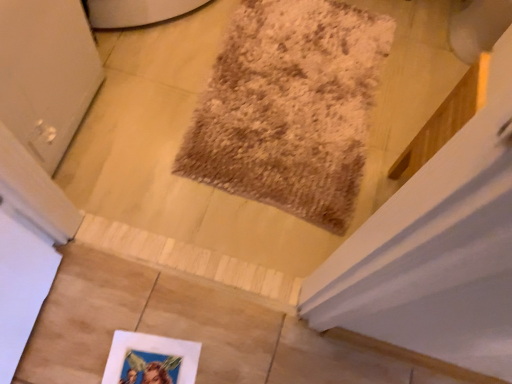
Describe the element at coordinates (150, 359) in the screenshot. I see `white matte picture frame at lower center` at that location.

Locate an element on the screen. This screenshot has width=512, height=384. white matte picture frame at lower center is located at coordinates (150, 359).

At what (x,y) coordinates should I click in order to perform the action: click on brown shaggy mat at center. Please return your answer as a coordinate pair (x, y). Looking at the image, I should click on (290, 107).

What do you see at coordinates (290, 107) in the screenshot?
I see `brown shaggy mat at center` at bounding box center [290, 107].

This screenshot has width=512, height=384. I want to click on white matte picture frame at lower center, so click(150, 359).

Which is more to the right, brown shaggy mat at center or white matte picture frame at lower center?

Positioned to the right is brown shaggy mat at center.

Which object is closer to the camera taking this photo, brown shaggy mat at center or white matte picture frame at lower center?

white matte picture frame at lower center is more forward.

Which is more distant, (355, 103) or (182, 358)?

The point (355, 103) is behind.

From the image's perspective, is brown shaggy mat at center under white matte picture frame at lower center?

Incorrect, from the image's perspective, brown shaggy mat at center is higher than white matte picture frame at lower center.

From a real-world perspective, is brown shaggy mat at center above or below white matte picture frame at lower center?

From a real-world perspective, brown shaggy mat at center is physically above white matte picture frame at lower center.

Is brown shaggy mat at center thinner than white matte picture frame at lower center?

No.

Is brown shaggy mat at center shorter than white matte picture frame at lower center?

In fact, brown shaggy mat at center may be taller than white matte picture frame at lower center.

Is brown shaggy mat at center bigger or smaller than white matte picture frame at lower center?

In the image, brown shaggy mat at center appears to be larger than white matte picture frame at lower center.

Is brown shaggy mat at center completely or partially outside of white matte picture frame at lower center?

brown shaggy mat at center lies outside white matte picture frame at lower center's area.

Is there a large distance between brown shaggy mat at center and white matte picture frame at lower center?

No, brown shaggy mat at center is in close proximity to white matte picture frame at lower center.

Is brown shaggy mat at center turned away from white matte picture frame at lower center?

That's not correct — brown shaggy mat at center is not looking away from white matte picture frame at lower center.

How much distance is there between brown shaggy mat at center and white matte picture frame at lower center?

They are 27.41 inches apart.

Find the location of a particular element. The image size is (512, 384). picture frame below the brown shaggy mat at center (from the image's perspective) is located at coordinates (150, 359).

Is white matte picture frame at lower center at the left side of brown shaggy mat at center?

Yes.

Is white matte picture frame at lower center closer to the viewer compared to brown shaggy mat at center?

Yes, white matte picture frame at lower center is closer to the viewer.

Which is behind, point (139, 336) or point (284, 193)?

The point (284, 193) is behind.

From the image's perspective, between white matte picture frame at lower center and brown shaggy mat at center, which one is located above?

brown shaggy mat at center, from the image's perspective.

From a real-world perspective, which object rests below the other?

From a 3D spatial view, white matte picture frame at lower center is below.

Does white matte picture frame at lower center have a lesser width compared to brown shaggy mat at center?

Correct, the width of white matte picture frame at lower center is less than that of brown shaggy mat at center.

Who is taller, white matte picture frame at lower center or brown shaggy mat at center?

brown shaggy mat at center is taller.

Which of these two, white matte picture frame at lower center or brown shaggy mat at center, is smaller?

white matte picture frame at lower center is smaller.

Is brown shaggy mat at center located within white matte picture frame at lower center?

Actually, brown shaggy mat at center is outside white matte picture frame at lower center.

Does white matte picture frame at lower center touch brown shaggy mat at center?

white matte picture frame at lower center and brown shaggy mat at center are clearly separated.

Could you tell me if white matte picture frame at lower center is turned towards brown shaggy mat at center?

Yes, white matte picture frame at lower center is turned towards brown shaggy mat at center.

At what (x,y) coordinates should I click in order to perform the action: click on picture frame directly beneath the brown shaggy mat at center (from a real-world perspective). Please return your answer as a coordinate pair (x, y). Image resolution: width=512 pixels, height=384 pixels. Looking at the image, I should click on point(150,359).

Identify the location of picture frame that is under the brown shaggy mat at center (from a real-world perspective). (150, 359).

You are a GUI agent. You are given a task and a screenshot of the screen. Output one action in this format:
    pyautogui.click(x=<x>, y=<y>)
    Task: Click on the mat located on the right of white matte picture frame at lower center
    This screenshot has width=512, height=384.
    Given the screenshot: What is the action you would take?
    pyautogui.click(x=290, y=107)